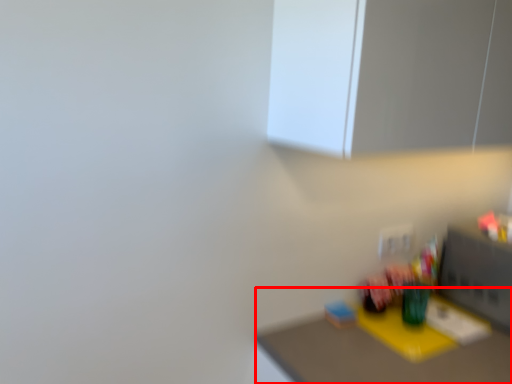
Question: From the image's perspective, where is table (annotated by the red box) located relative to medicine cabinet?

Choices:
 (A) below
 (B) above

Answer: (A)